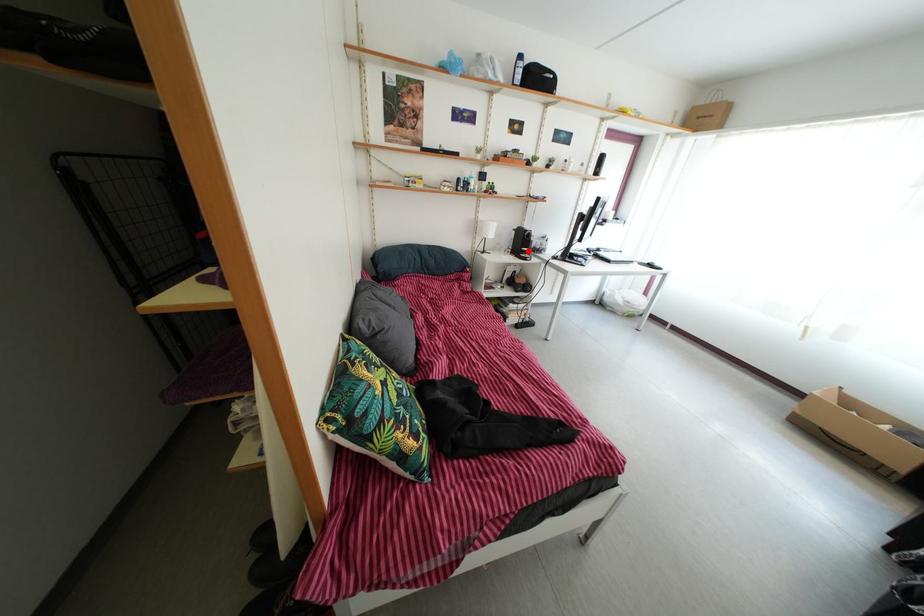
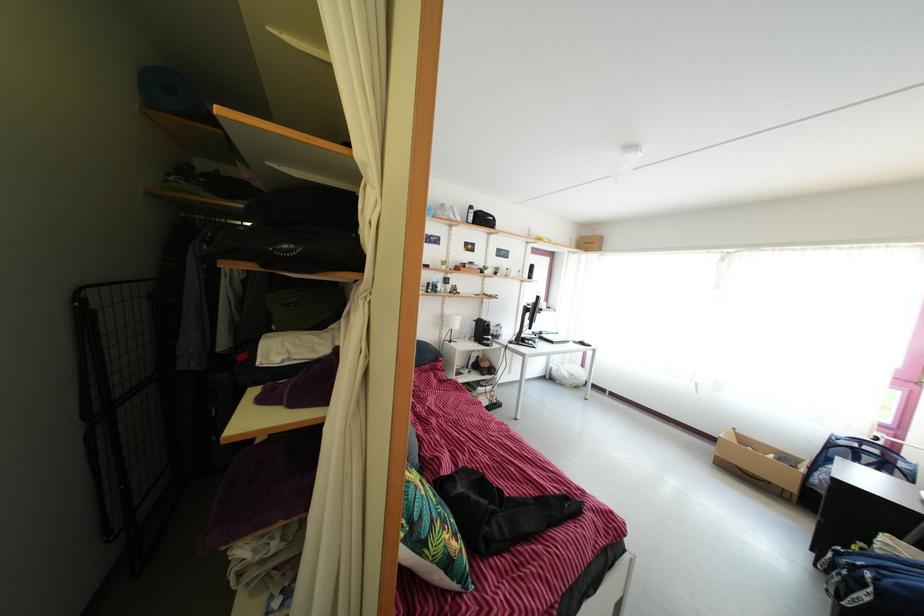
The point at the highlighted location is marked in the first image. Where is the corresponding point in the second image?

(489, 339)